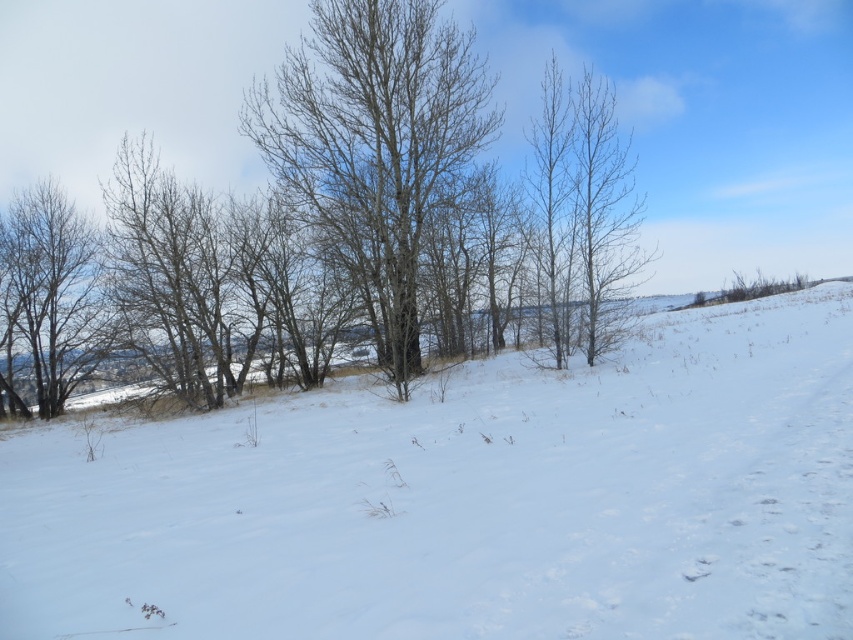
You are a skier planning to ski down the snowy white ski slope at center and the brown bark tree at left. Which one is taller?

The brown bark tree at left is taller than the snowy white ski slope at center.

You are a skier planning to descend the snowy white ski slope at center. There is a brown bark tree at left in your line of sight. Based on the scene, will the tree be visible to you as you go down the slope?

The snowy white ski slope at center is in front of brown bark tree at left, so the tree will be visible behind the slope as you descend.

You are a skier planning to descend the snowy white ski slope at center. There is a bare wood tree at center in your path. Can you safely go around it without hitting the tree?

The snowy white ski slope at center is below the bare wood tree at center, meaning the tree is positioned higher up the slope. Since the tree is above you on the slope, you can safely ski around it by taking a path either to the left or right of the tree as you descend.